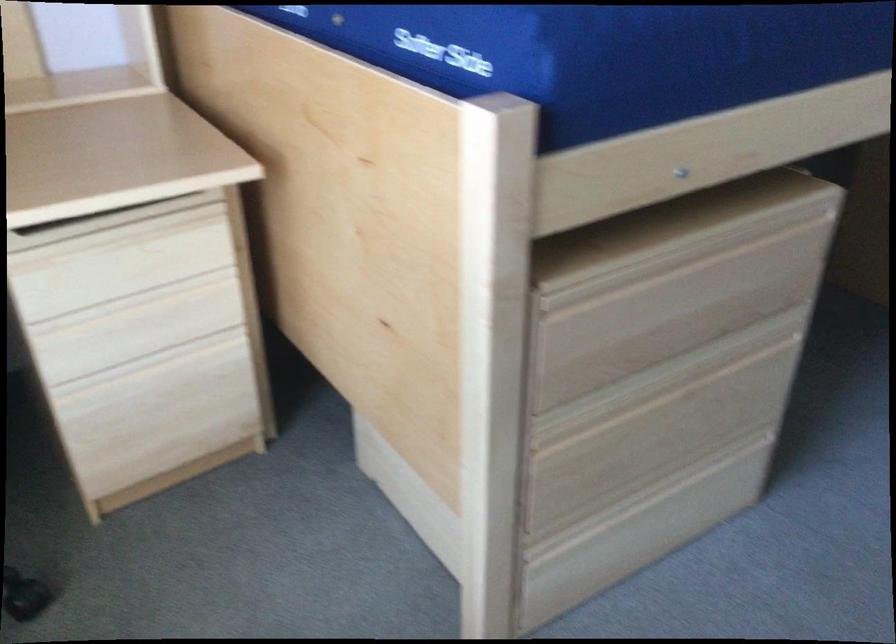
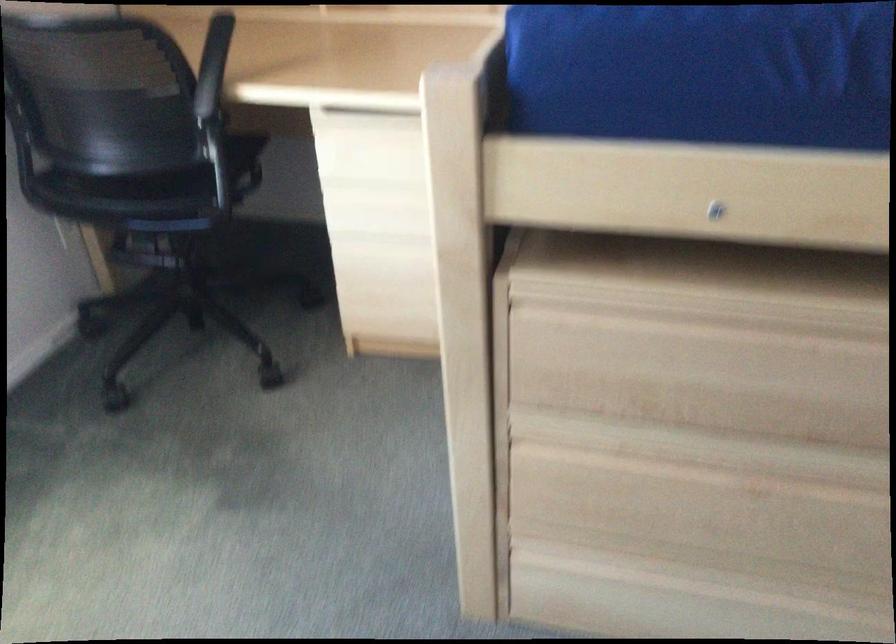
Where in the second image is the point corresponding to pixel 73 232 from the first image?

(364, 117)